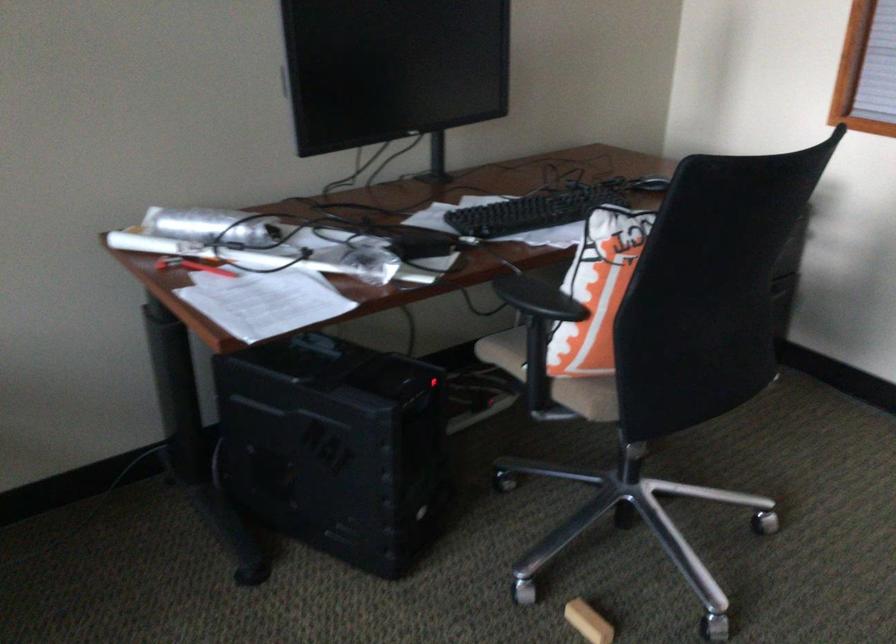
The height and width of the screenshot is (644, 896). Identify the location of small wooden block. (588, 621).